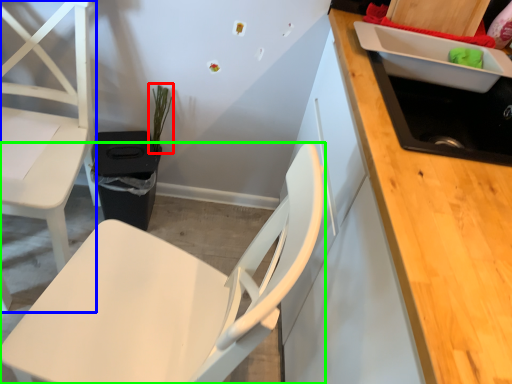
Question: Considering the real-world distances, which object is farthest from plant (highlighted by a red box)? chair (highlighted by a blue box) or chair (highlighted by a green box)?

Choices:
 (A) chair
 (B) chair

Answer: (B)